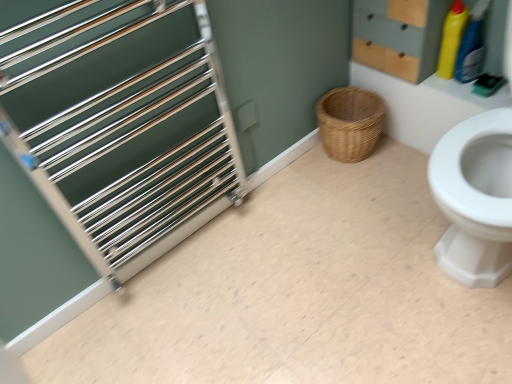
Locate an element on the screen. The width and height of the screenshot is (512, 384). vacant space in between polished metal rack at left and woven natural basket at lower center is located at coordinates (274, 207).